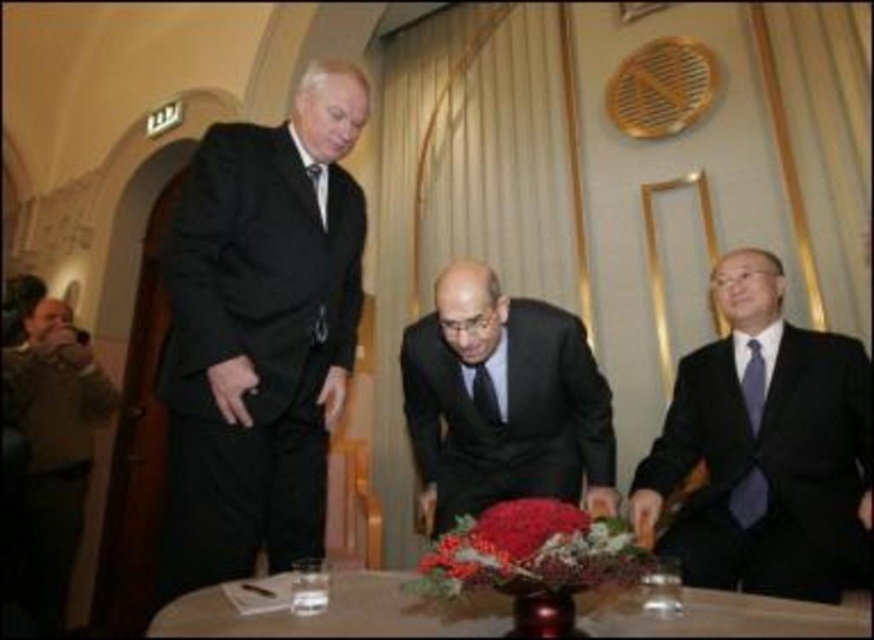
Question: Does white glossy table at center have a smaller size compared to purple satin tie at right?

Choices:
 (A) no
 (B) yes

Answer: (A)

Question: Does brown fuzzy sweater at left have a smaller size compared to black silk tie at center?

Choices:
 (A) no
 (B) yes

Answer: (A)

Question: Which of the following is the farthest from the observer?

Choices:
 (A) (795, 376)
 (B) (744, 502)
 (C) (341, 573)
 (D) (498, 435)

Answer: (D)

Question: Which object appears farthest from the camera in this image?

Choices:
 (A) white glossy table at center
 (B) brown fuzzy sweater at left
 (C) purple satin tie at right
 (D) black silk tie at center

Answer: (B)

Question: Estimate the real-world distances between objects in this image. Which object is farther from the purple satin tie at right?

Choices:
 (A) black silk suit at center
 (B) matte black tie at left

Answer: (B)

Question: Is matte black suit at right wider than black silk suit at center?

Choices:
 (A) yes
 (B) no

Answer: (A)